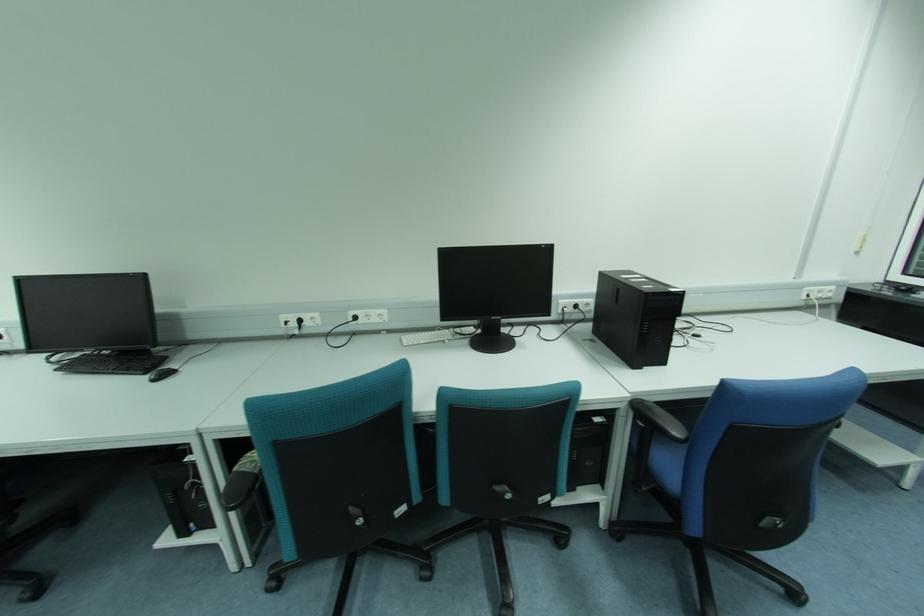
Identify the location of black computer keyboard. Image resolution: width=924 pixels, height=616 pixels. (114, 362).